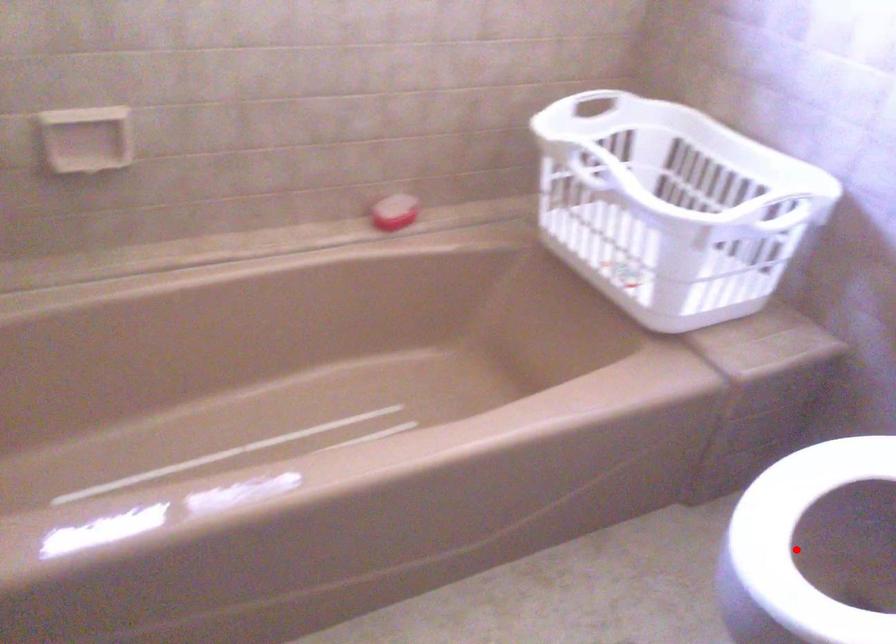
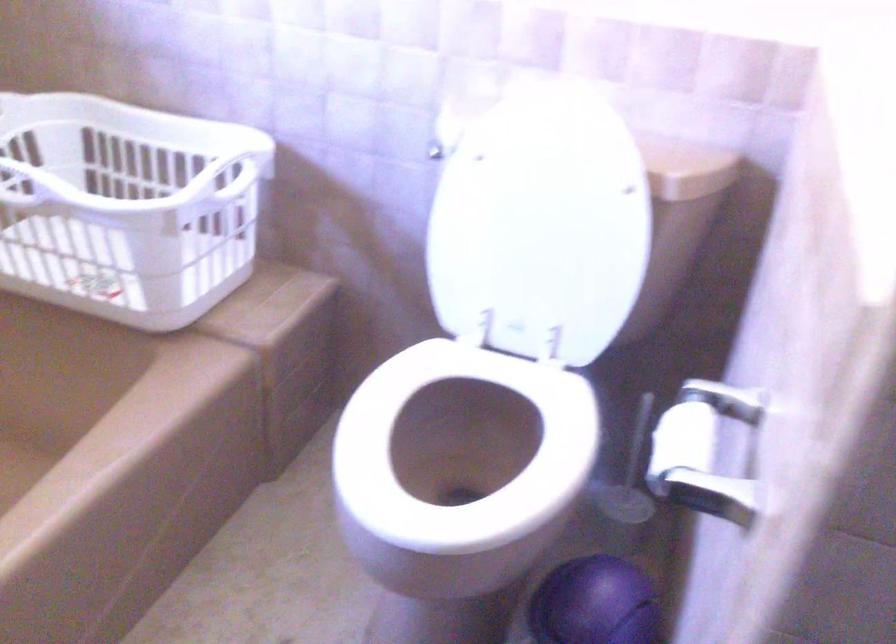
Question: I am providing you with two images of the same scene from different viewpoints. A red point is marked on the first image. Is the red point's position out of view in image 2?

Choices:
 (A) Yes
 (B) No

Answer: (A)